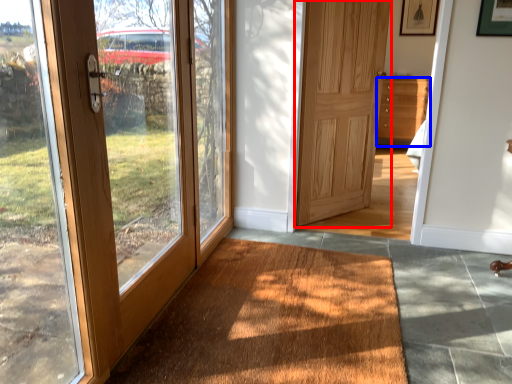
Question: Which of the following is the farthest to the observer, door (highlighted by a red box) or chest of drawers (highlighted by a blue box)?

Choices:
 (A) door
 (B) chest of drawers

Answer: (B)